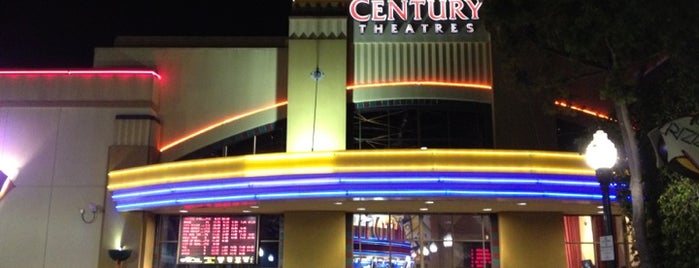
At what (x,y) coordinates should I click in order to perform the action: click on orange neon light. Please return your answer as a coordinate pair (x, y). Looking at the image, I should click on (412, 83).